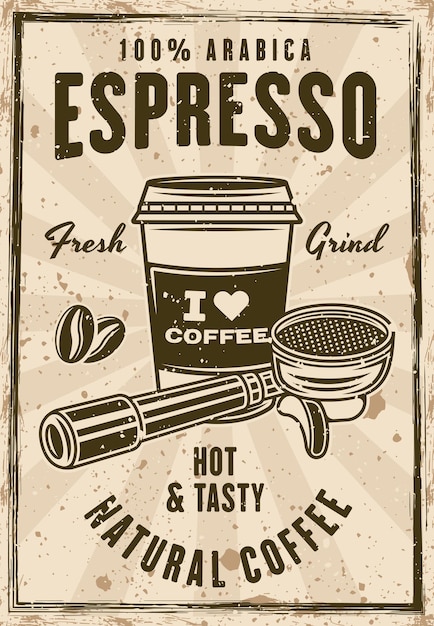
This screenshot has width=434, height=626. Identify the location of screen. click(x=336, y=356).